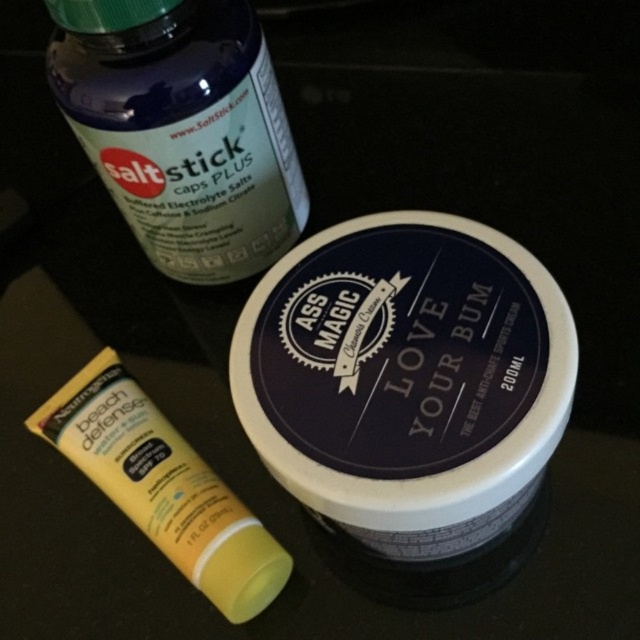
Question: Which point appears closest to the camera in this image?

Choices:
 (A) (122, 481)
 (B) (364, 259)

Answer: (B)

Question: Estimate the real-world distances between objects in this image. Which object is closer to the translucent plastic bottle at upper left?

Choices:
 (A) white matte jar at center
 (B) yellow matte tube at lower left

Answer: (A)

Question: Which point appears closest to the camera in this image?

Choices:
 (A) (144, 452)
 (B) (282, 134)
 (C) (476, 342)

Answer: (C)

Question: Does white matte jar at center appear on the right side of translucent plastic bottle at upper left?

Choices:
 (A) yes
 (B) no

Answer: (A)

Question: Can you confirm if white matte jar at center is positioned to the right of yellow matte tube at lower left?

Choices:
 (A) no
 (B) yes

Answer: (B)

Question: Can you confirm if translucent plastic bottle at upper left is smaller than yellow matte tube at lower left?

Choices:
 (A) yes
 (B) no

Answer: (B)